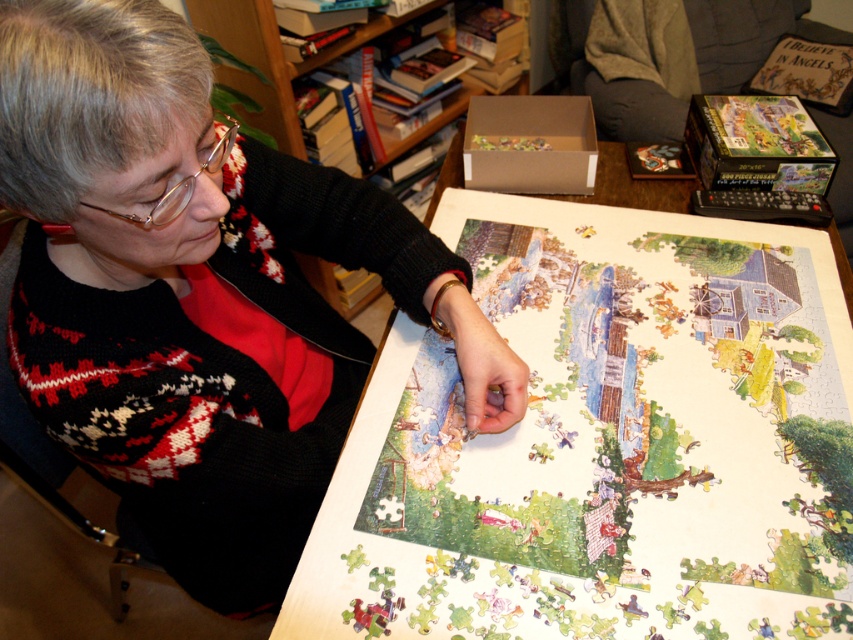
Can you confirm if white wood table at center is positioned below wooden bookshelf at upper center?

Indeed, white wood table at center is positioned under wooden bookshelf at upper center.

Is point (376, 618) closer to camera compared to point (312, 268)?

Yes, it is.

You are a GUI agent. You are given a task and a screenshot of the screen. Output one action in this format:
    pyautogui.click(x=<x>, y=<y>)
    Task: Click on the white wood table at center
    This screenshot has width=853, height=640.
    Given the screenshot: What is the action you would take?
    pyautogui.click(x=601, y=442)

Does knitted sweater at center come behind wooden bookshelf at upper center?

That is False.

Does point (126, 150) come farther from viewer compared to point (241, 58)?

No, (126, 150) is in front of (241, 58).

Identify the location of knitted sweater at center. (198, 292).

Measure the distance between white wood table at center and knitted sweater at center.

white wood table at center and knitted sweater at center are 8.73 inches apart.

Between white wood table at center and knitted sweater at center, which one is positioned lower?

Positioned lower is white wood table at center.

Who is more forward, (476, 266) or (231, 214)?

Point (231, 214) is more forward.

You are a GUI agent. You are given a task and a screenshot of the screen. Output one action in this format:
    pyautogui.click(x=<x>, y=<y>)
    Task: Click on the white wood table at center
    The width and height of the screenshot is (853, 640).
    Given the screenshot: What is the action you would take?
    pyautogui.click(x=601, y=442)